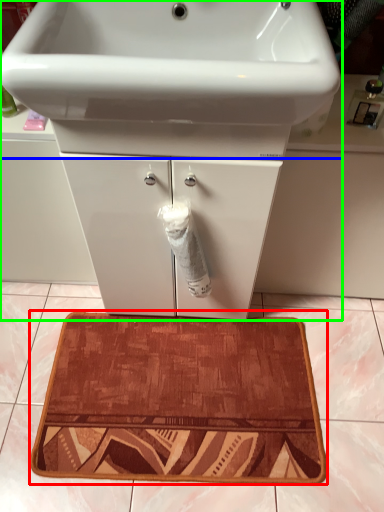
Question: Which object is positioned farthest from bath mat (highlighted by a red box)? Select from sink (highlighted by a blue box) and bathroom cabinet (highlighted by a green box).

Choices:
 (A) sink
 (B) bathroom cabinet

Answer: (A)